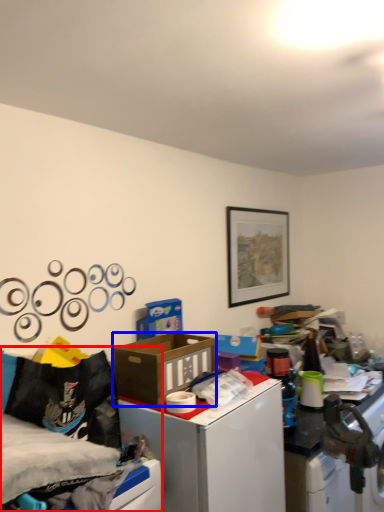
Question: Which object appears farthest to the camera in this image, bed (highlighted by a red box) or box (highlighted by a blue box)?

Choices:
 (A) bed
 (B) box

Answer: (B)